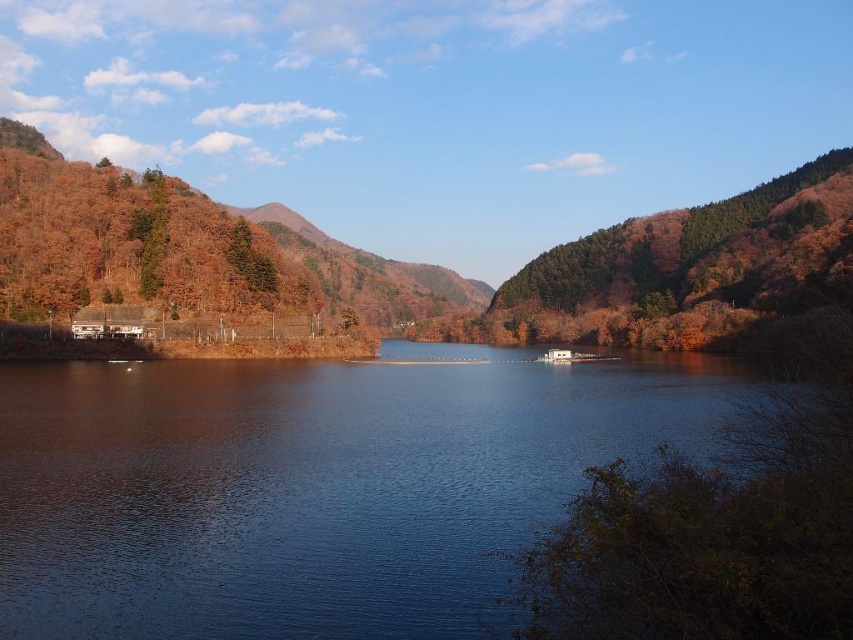
You are standing at the edge of the lake and see the blue water at center and the green matte tree at upper left. Which object is positioned higher in the image?

The green matte tree at upper left is positioned higher in the image than the blue water at center.

You are standing at the edge of the lake and want to take a photo that includes both the blue water at center and the green matte tree at upper left. Which object will appear larger in the photo?

The blue water at center will appear larger in the photo because it is closer to the viewer than the green matte tree at upper left.